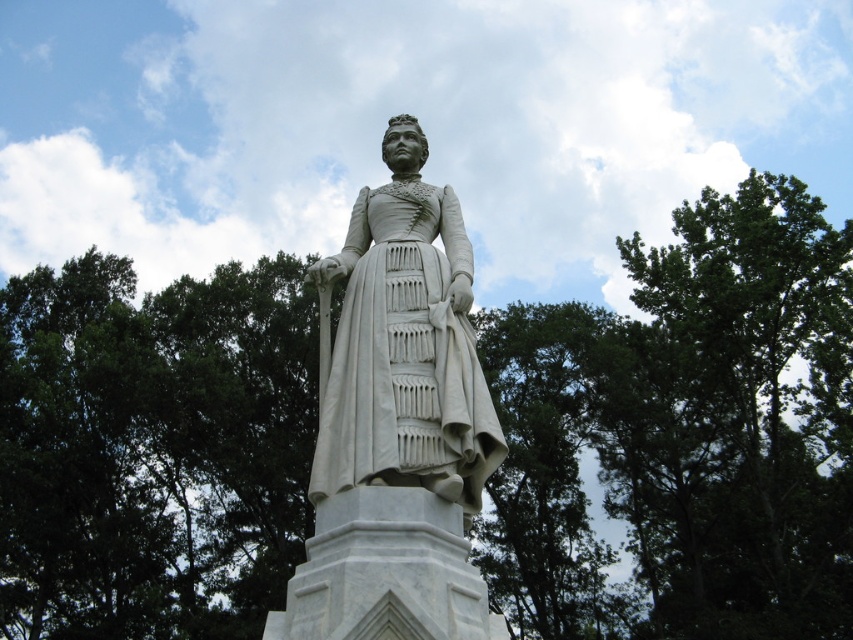
Question: Which of the following is the closest to the observer?

Choices:
 (A) white marble statue at center
 (B) green leafy tree at center

Answer: (A)

Question: Is green leafy tree at center thinner than white marble statue at center?

Choices:
 (A) no
 (B) yes

Answer: (A)

Question: Does green leafy tree at center appear on the left side of white marble statue at center?

Choices:
 (A) no
 (B) yes

Answer: (B)

Question: Which object appears farthest from the camera in this image?

Choices:
 (A) green leafy tree at center
 (B) white marble statue at center

Answer: (A)

Question: Can you confirm if green leafy tree at center is positioned to the left of white marble statue at center?

Choices:
 (A) no
 (B) yes

Answer: (B)